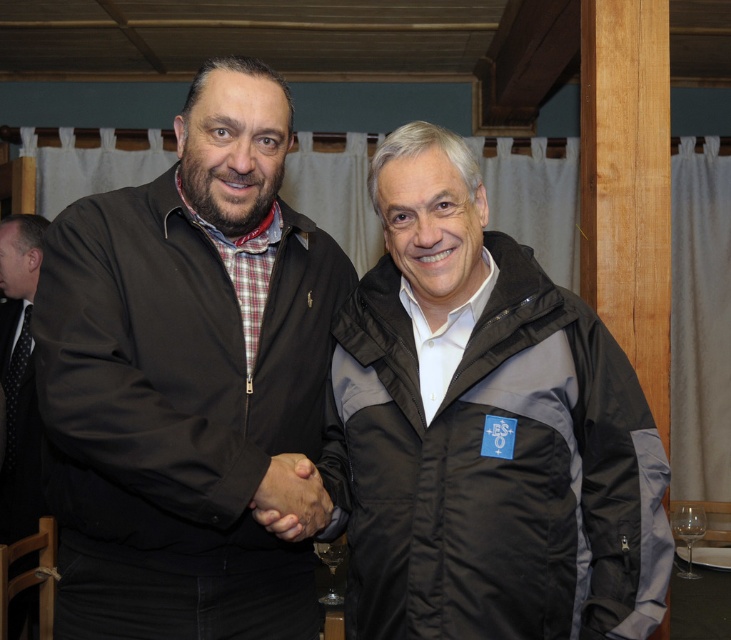
You are a photographer trying to capture a clear shot of the transparent glass at lower center. However, the black puffy jacket at center is blocking your view. Can you move the jacket to get an unobstructed view of the glass?

The black puffy jacket at center is positioned over the transparent glass at lower center, so moving the jacket would allow you to see the glass without obstruction.

You are a photographer standing at the back of the room. You want to take a photo of the matte black jacket at left and the transparent glass at lower center. Which object will appear larger in the photo?

The matte black jacket at left will appear larger in the photo because it is closer to the viewer than the transparent glass at lower center.

You are standing in the room where the handshake is taking place. The point at coordinate [189,381] is part of which object?

The point at coordinate [189,381] corresponds to the matte black jacket at left.